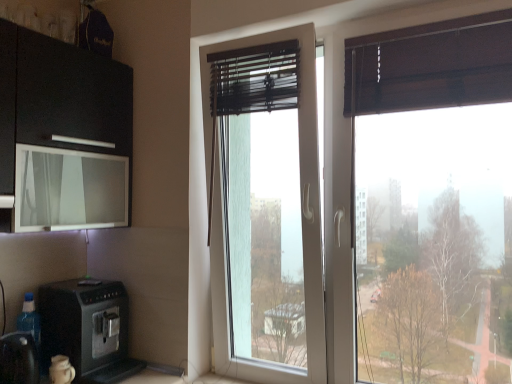
Question: From a real-world perspective, is transparent glass window at center below black plastic coffee machine at lower left?

Choices:
 (A) yes
 (B) no

Answer: (B)

Question: Considering the relative sizes of transparent glass window at center and black plastic coffee machine at lower left in the image provided, is transparent glass window at center bigger than black plastic coffee machine at lower left?

Choices:
 (A) no
 (B) yes

Answer: (B)

Question: From a real-world perspective, is transparent glass window at center located higher than black plastic coffee machine at lower left?

Choices:
 (A) yes
 (B) no

Answer: (A)

Question: Are transparent glass window at center and black plastic coffee machine at lower left located far from each other?

Choices:
 (A) no
 (B) yes

Answer: (A)

Question: Can you confirm if transparent glass window at center is smaller than black plastic coffee machine at lower left?

Choices:
 (A) no
 (B) yes

Answer: (A)

Question: From the image's perspective, is transparent glass window at center above black plastic coffee machine at lower left?

Choices:
 (A) no
 (B) yes

Answer: (B)

Question: Does black plastic coffee machine at lower left have a greater height compared to black plastic coffee machine at lower left?

Choices:
 (A) yes
 (B) no

Answer: (A)

Question: Is black plastic coffee machine at lower left smaller than black plastic coffee machine at lower left?

Choices:
 (A) yes
 (B) no

Answer: (B)

Question: Does black plastic coffee machine at lower left come in front of black plastic coffee machine at lower left?

Choices:
 (A) no
 (B) yes

Answer: (A)

Question: From the image's perspective, is black plastic coffee machine at lower left located beneath black plastic coffee machine at lower left?

Choices:
 (A) yes
 (B) no

Answer: (B)

Question: Does black plastic coffee machine at lower left appear on the right side of black plastic coffee machine at lower left?

Choices:
 (A) no
 (B) yes

Answer: (B)

Question: Considering the relative sizes of black plastic coffee machine at lower left and black plastic coffee machine at lower left in the image provided, is black plastic coffee machine at lower left bigger than black plastic coffee machine at lower left?

Choices:
 (A) no
 (B) yes

Answer: (B)

Question: Is black plastic coffee machine at lower left shorter than transparent glass window at center?

Choices:
 (A) no
 (B) yes

Answer: (B)